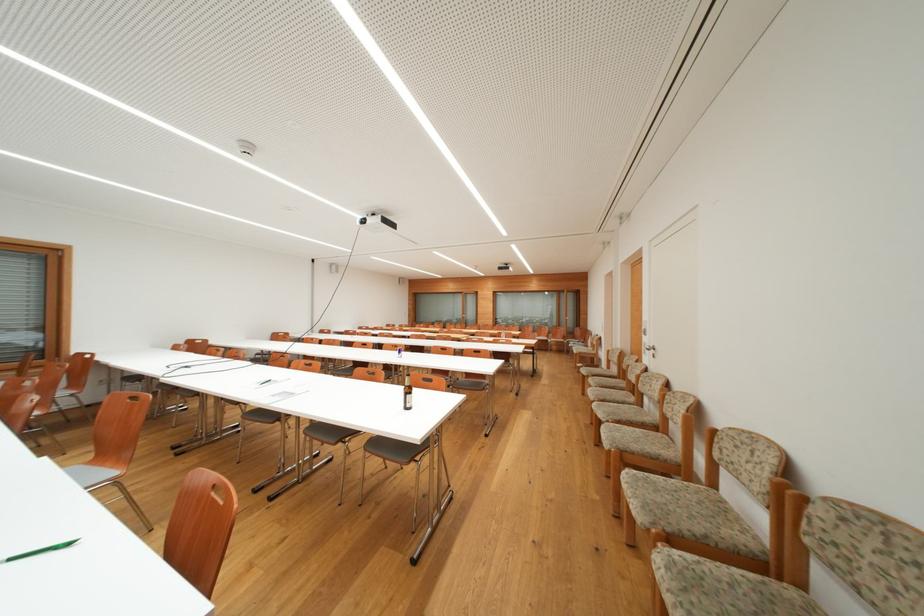
Where would you pull the metal door handle? Please return your answer as a coordinate pair (x, y).

(650, 349)